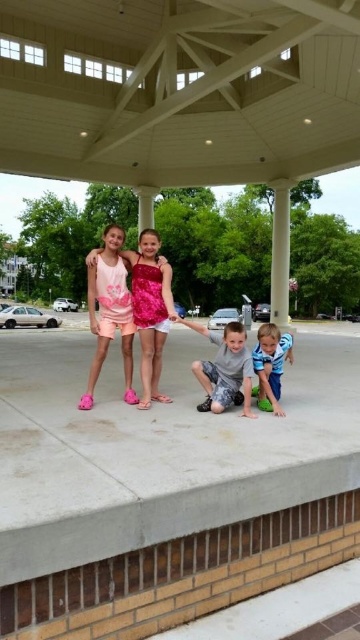
You are a photographer trying to capture a photo of the shiny pink dress at center and the white smooth column at center. Based on the scene description, which object is wider?

The shiny pink dress at center is wider than the white smooth column at center since its width surpasses that of the column.

You are a photographer trying to capture a photo of the shiny pink dress at center and the blue cotton shirt at lower right. Which of the two clothing items is positioned higher in the image?

The shiny pink dress at center is taller than the blue cotton shirt at lower right, so it is positioned higher in the image.

You are a photographer setting up a shoot for two models wearing the shiny pink dress at center and gray camouflage pants at center. The camera is positioned to capture both subjects in frame. Which model should stand closer to the camera to ensure their full width fits within the shot?

The model wearing the shiny pink dress at center should stand closer to the camera because its width surpasses that of the gray camouflage pants at center, requiring more space to fit within the frame.